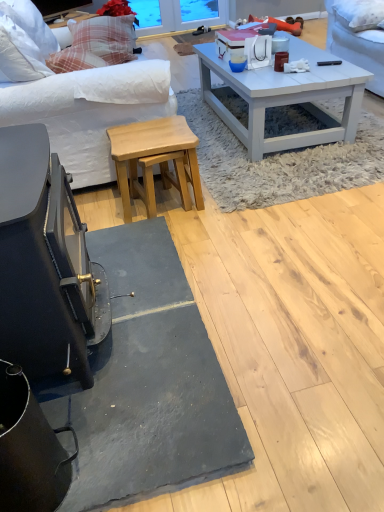
Question: From a real-world perspective, relative to white soft pillow at upper right, placed as the 1th pillow when sorted from right to left, is matte brown coffee cup at center, the 1th coffee cup viewed from the right, vertically above or below?

Choices:
 (A) below
 (B) above

Answer: (A)

Question: Based on their sizes in the image, would you say matte brown coffee cup at center, the 1th coffee cup viewed from the right, is bigger or smaller than white soft pillow at upper right, the 2th pillow positioned from the back?

Choices:
 (A) small
 (B) big

Answer: (A)

Question: Which object is the closest to the matte black television at upper left?

Choices:
 (A) white painted wood coffee table at center
 (B) plaid fabric pillow at upper left, marked as the 1th pillow in a left-to-right arrangement
 (C) matte brown coffee cup at center, the 1th coffee cup viewed from the right
 (D) white soft pillow at upper right, the 2th pillow positioned from the left
 (E) white fabric cushion at upper left

Answer: (B)

Question: Which object is the farthest from the plaid fabric pillow at upper left, the second pillow when ordered from front to back?

Choices:
 (A) matte black television at upper left
 (B) white fabric cushion at upper left
 (C) white soft pillow at upper right, acting as the 1th pillow starting from the front
 (D) matte brown coffee cup at center, the 1th coffee cup viewed from the right
 (E) matte blue cup at center, positioned as the 2th coffee cup in right-to-left order

Answer: (C)